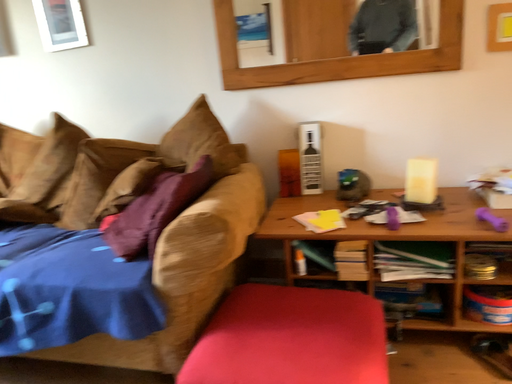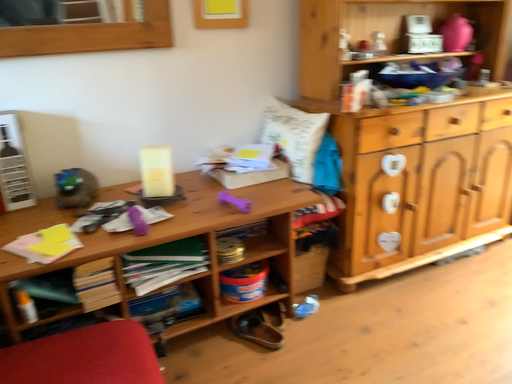
Question: Which way did the camera rotate in the video?

Choices:
 (A) rotated right
 (B) rotated left

Answer: (A)